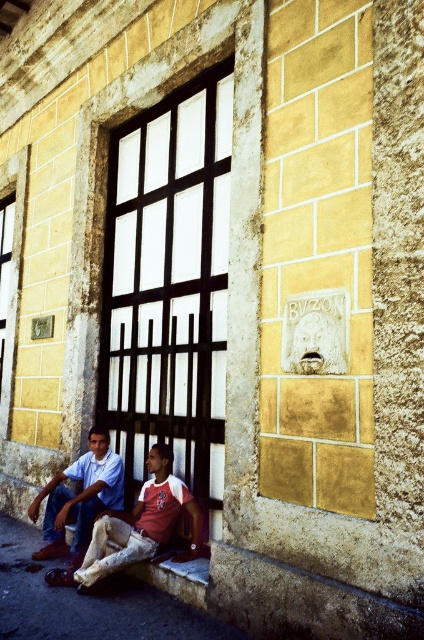
You are a painter who needs to decide whether to place a large canvas between the wooden bars at center and the white cotton shirt at lower left. Based on their sizes, will the canvas fit without overlapping either object?

The wooden bars at center is bigger than the white cotton shirt at lower left. Therefore, the canvas should be placed between them, ensuring it is larger than the wooden bars at center to avoid overlapping both objects.

You are a painter who wants to place a canvas between the wooden bars at center and the matte blue jeans at lower left. Based on their positions, where should the canvas be placed?

The wooden bars at center are to the right of the matte blue jeans at lower left, so the canvas should be placed between them, to the right of the matte blue jeans at lower left and left of the wooden bars at center.

From the picture: You are a fashion designer observing the image. You notice the white cotton shirt at lower left and the matte blue jeans at lower left. Which clothing item is closer to the bottom edge of the image?

The white cotton shirt at lower left is positioned under the matte blue jeans at lower left, so the white cotton shirt at lower left is closer to the bottom edge of the image.